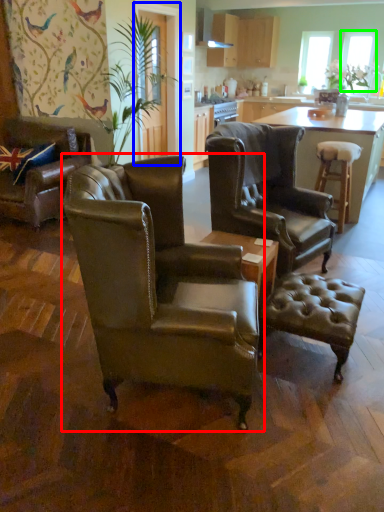
Question: Estimate the real-world distances between objects in this image. Which object is farther from chair (highlighted by a red box), glass door (highlighted by a blue box) or window screen (highlighted by a green box)?

Choices:
 (A) glass door
 (B) window screen

Answer: (B)